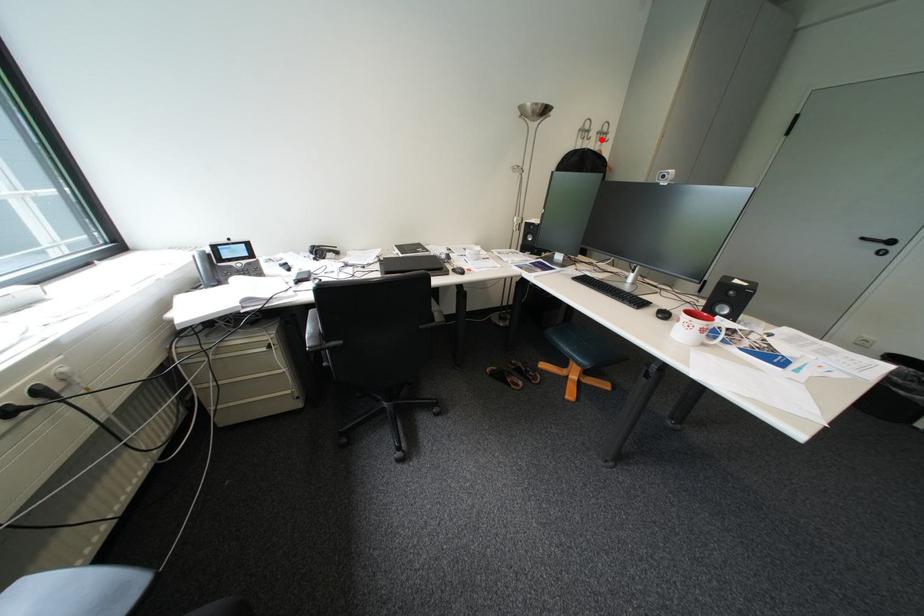
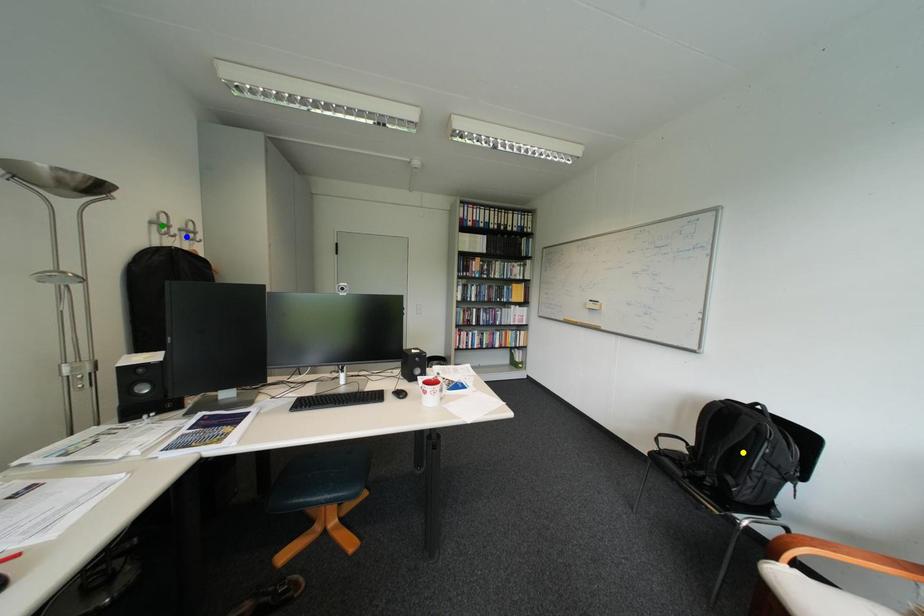
Question: I am providing you with two images of the same scene from different viewpoints. A red point is marked on the first image. You are given multiple points on the second image. Which mark in image 2 goes with the point in image 1?

Choices:
 (A) yellow point
 (B) green point
 (C) blue point

Answer: (C)